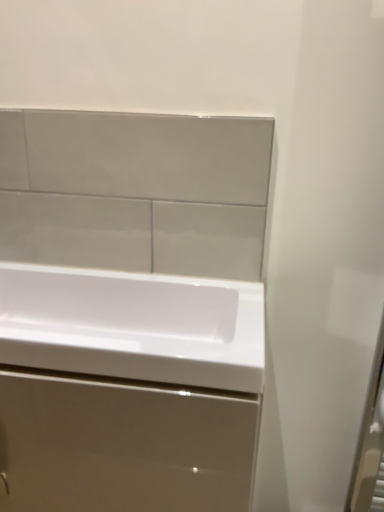
Identify the location of white glossy sink at lower center. The width and height of the screenshot is (384, 512). (128, 390).

Measure the distance between point (93, 506) and camera.

24.88 inches.

The height and width of the screenshot is (512, 384). Describe the element at coordinates (128, 390) in the screenshot. I see `white glossy sink at lower center` at that location.

Measure the distance between white glossy sink at lower center and camera.

white glossy sink at lower center and camera are 20.22 inches apart.

Where is `white glossy sink at lower center`? This screenshot has width=384, height=512. white glossy sink at lower center is located at coordinates (128, 390).